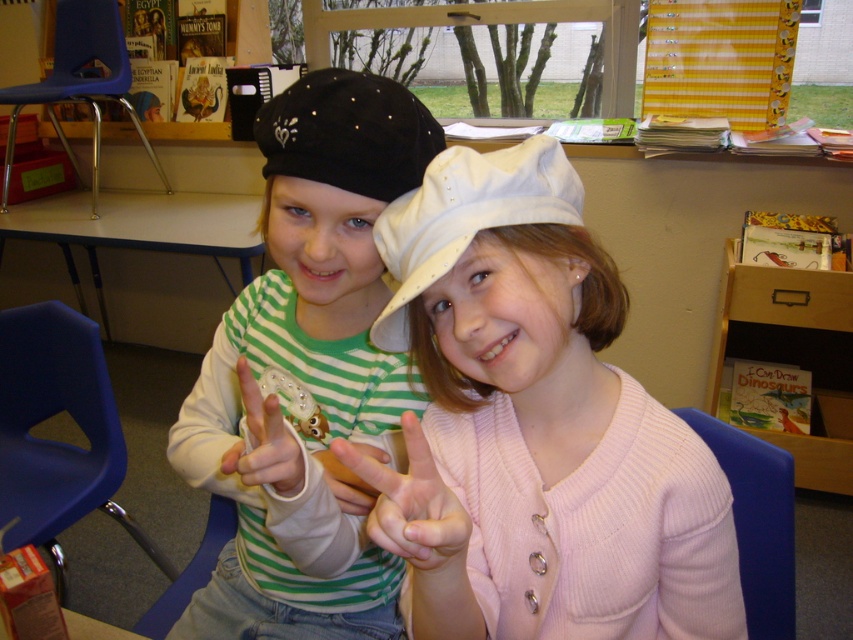
Is point (320, 440) in front of point (276, 449)?

No.

The height and width of the screenshot is (640, 853). Describe the element at coordinates (308, 349) in the screenshot. I see `matte black hat at center` at that location.

What are the coordinates of `matte black hat at center` in the screenshot? It's located at coord(308,349).

Describe the element at coordinates (535, 426) in the screenshot. This screenshot has width=853, height=640. I see `white knit hat at center` at that location.

Is point (543, 337) behind point (427, 570)?

Yes, it is.

Identify the location of white knit hat at center. Image resolution: width=853 pixels, height=640 pixels. (535, 426).

Between point (463, 168) and point (339, 96), which one is positioned behind?

The point (339, 96) is more distant.

Where is `white fabric hat at center`? The image size is (853, 640). white fabric hat at center is located at coordinates (466, 216).